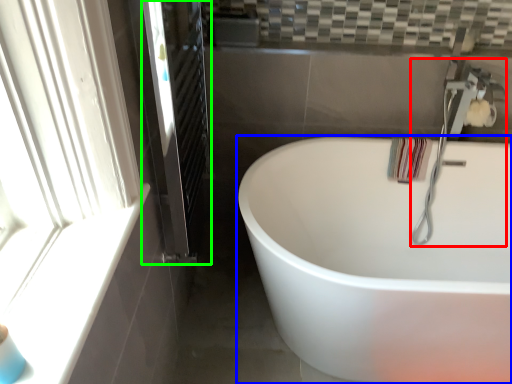
Question: Which object is positioned closest to faucet (highlighted by a red box)? Select from bathtub (highlighted by a blue box) and screen door (highlighted by a green box).

Choices:
 (A) bathtub
 (B) screen door

Answer: (A)